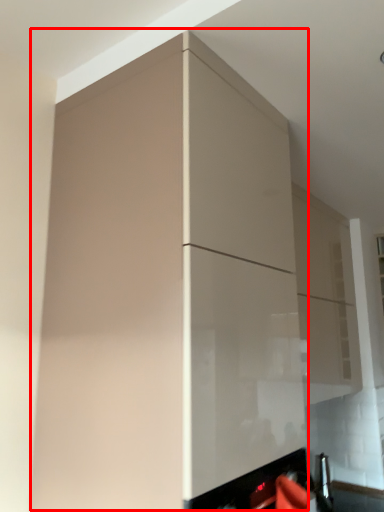
Question: Where is cabinetry (annotated by the red box) located in relation to cabinetry in the image?

Choices:
 (A) left
 (B) right

Answer: (A)